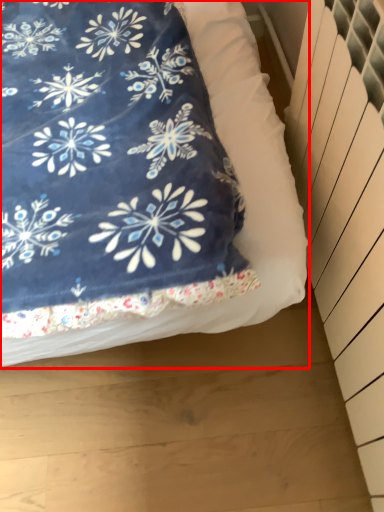
Question: From the image's perspective, where is bed (annotated by the red box) located in relation to radiator in the image?

Choices:
 (A) above
 (B) below

Answer: (A)